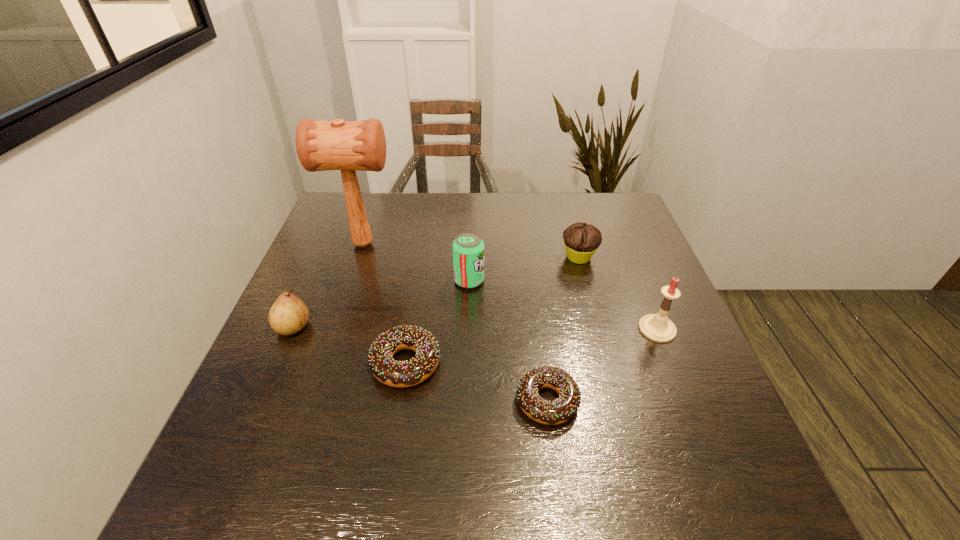
This screenshot has height=540, width=960. What are the coordinates of `free space for a new doughnut on the right` in the screenshot? It's located at (713, 446).